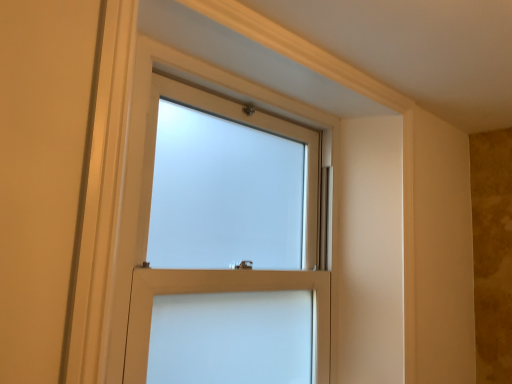
The image size is (512, 384). I want to click on free space above clear glass window at upper center (from a real-world perspective), so click(264, 92).